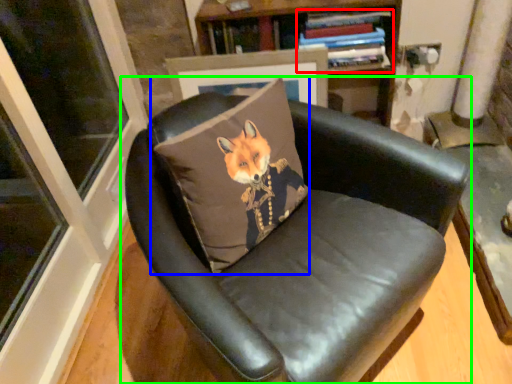
Question: Which is nearer to the book (highlighted by a red box)? throw pillow (highlighted by a blue box) or chair (highlighted by a green box).

Choices:
 (A) throw pillow
 (B) chair

Answer: (A)